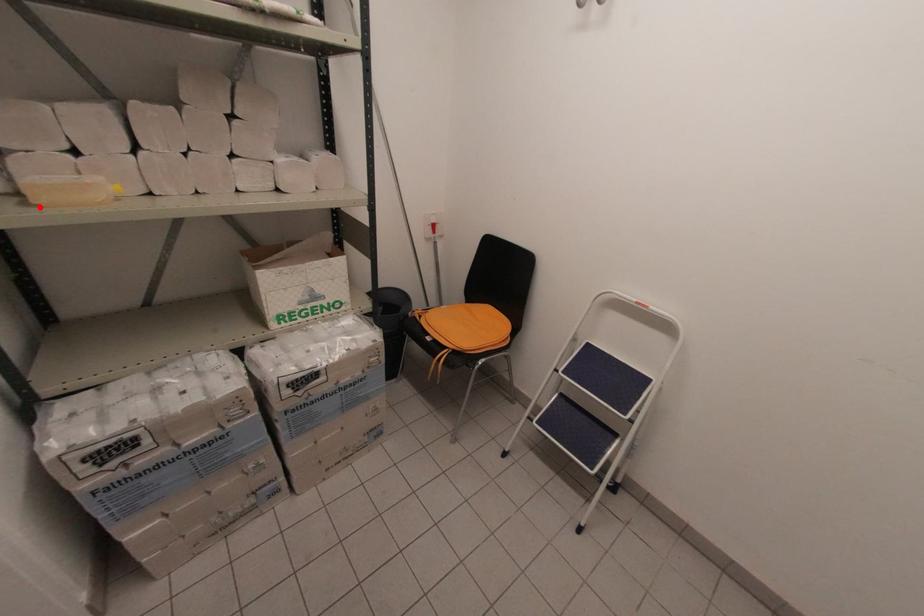
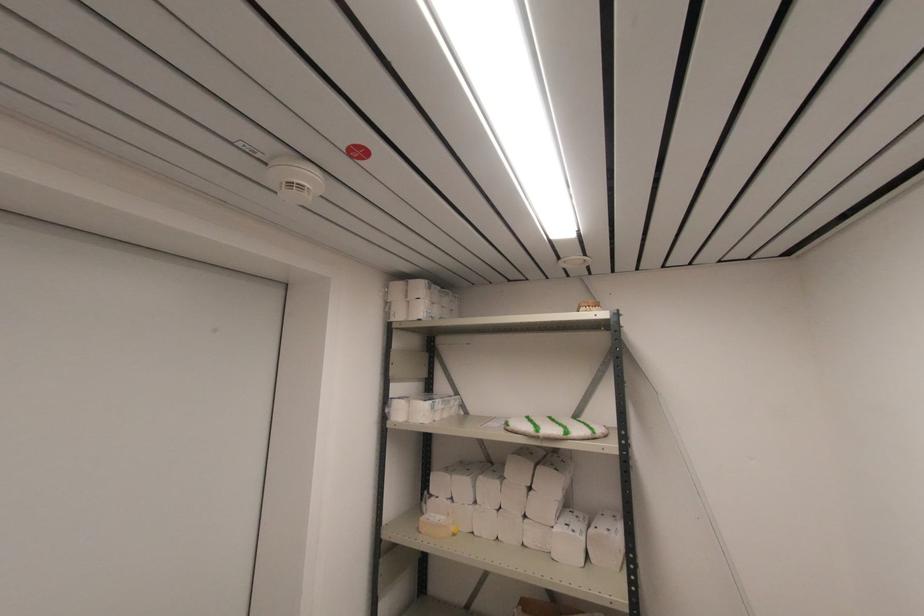
Where in the second image is the point corresponding to the highlighted location from the first image?

(420, 533)